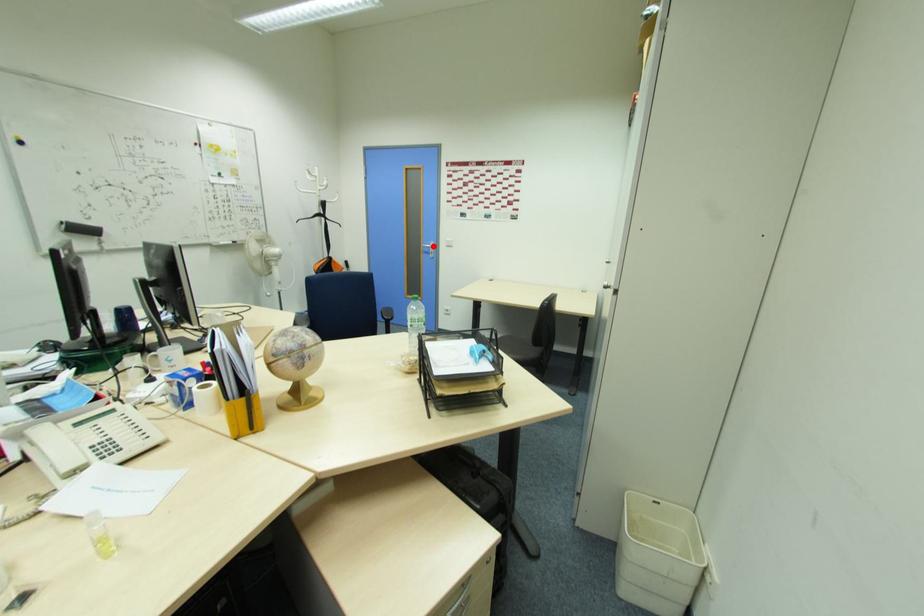
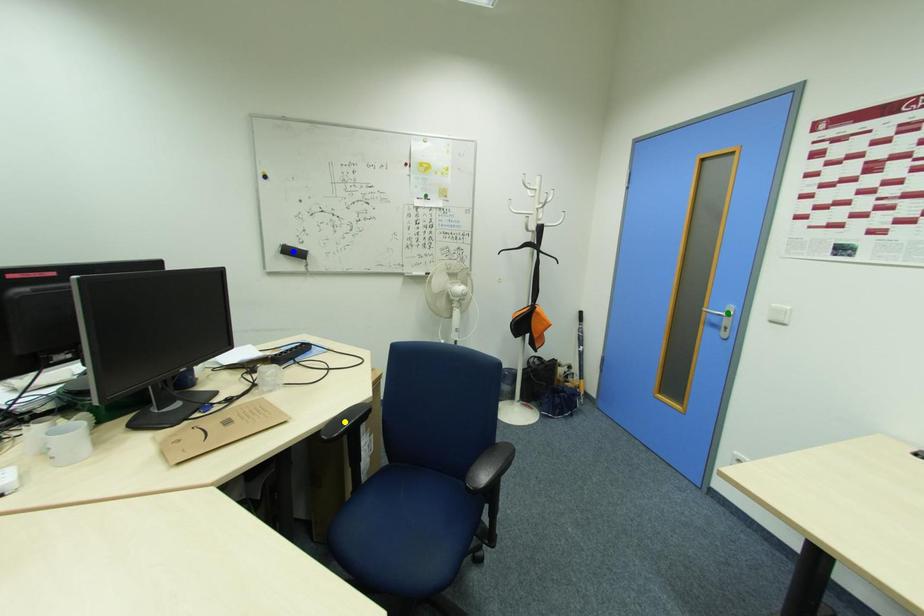
Question: I am providing you with two images of the same scene from different viewpoints. A red point is marked on the first image. You are given multiple points on the second image. Which spot in image 2 lines up with the point in image 1?

Choices:
 (A) yellow point
 (B) blue point
 (C) green point

Answer: (C)